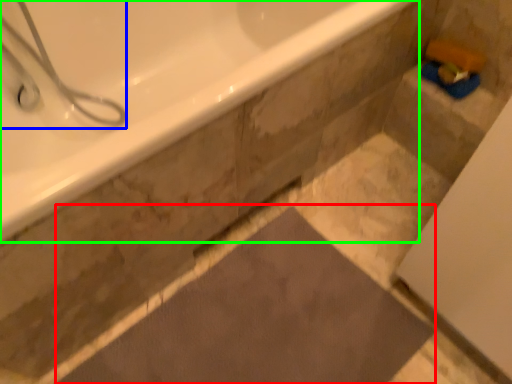
Question: Based on their relative distances, which object is nearer to bath mat (highlighted by a red box)? Choose from shower (highlighted by a blue box) and bathtub (highlighted by a green box).

Choices:
 (A) shower
 (B) bathtub

Answer: (B)